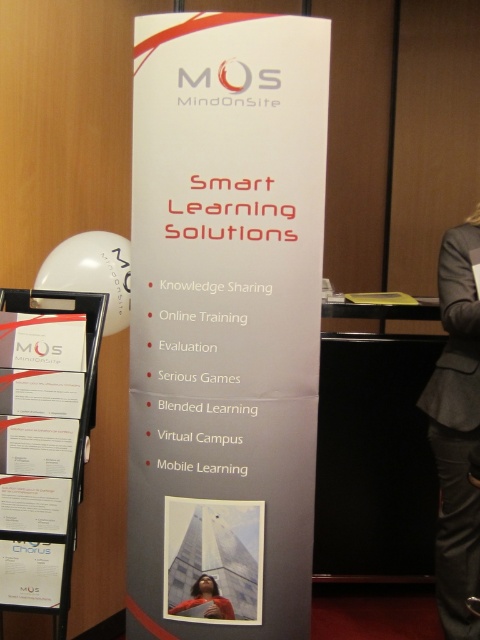
Who is lower down, gray woolen blazer at right or matte red poster at center?

matte red poster at center is lower down.

Can you confirm if gray woolen blazer at right is wider than matte red poster at center?

No, gray woolen blazer at right is not wider than matte red poster at center.

Locate an element on the screen. Image resolution: width=480 pixels, height=640 pixels. gray woolen blazer at right is located at coordinates (456, 429).

Between white paper at center and matte red poster at center, which one is positioned lower?

matte red poster at center is lower down.

Is white paper at center above matte red poster at center?

Yes, white paper at center is above matte red poster at center.

Locate an element on the screen. This screenshot has width=480, height=640. white paper at center is located at coordinates (225, 320).

In the scene shown: Who is positioned more to the right, white paper at left or red sweater at center?

From the viewer's perspective, red sweater at center appears more on the right side.

You are a GUI agent. You are given a task and a screenshot of the screen. Output one action in this format:
    pyautogui.click(x=<x>, y=<y>)
    Task: Click on the white paper at left
    This screenshot has width=480, height=640.
    Given the screenshot: What is the action you would take?
    pyautogui.click(x=37, y=448)

Is point (9, 378) positioned in front of point (192, 586)?

Yes, point (9, 378) is closer to viewer.

The height and width of the screenshot is (640, 480). In order to click on white paper at left in this screenshot , I will do `click(37, 448)`.